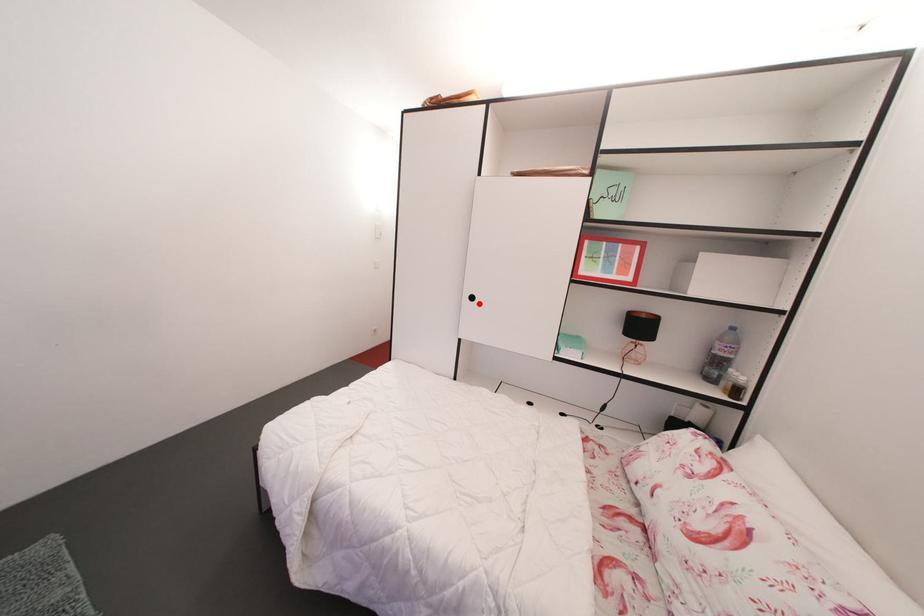
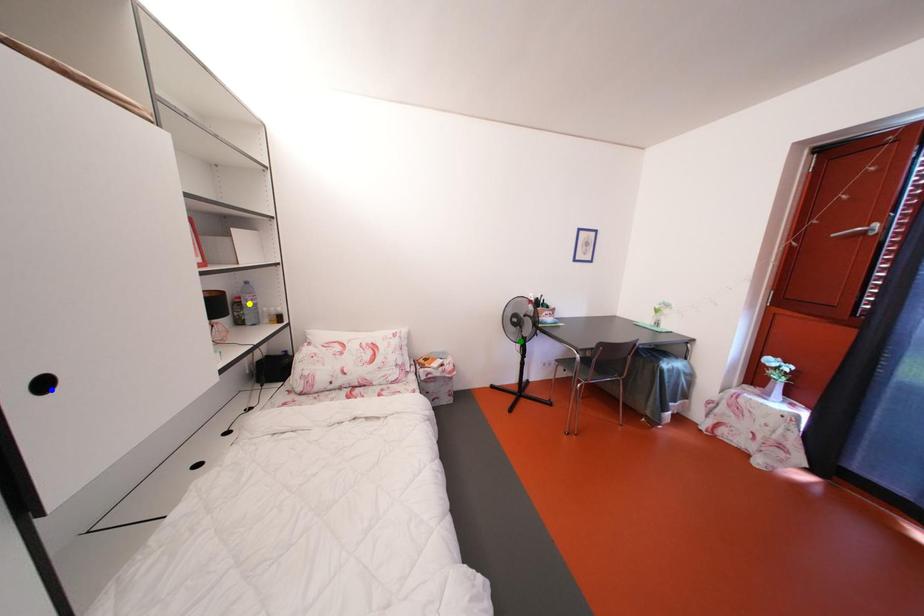
Question: I am providing you with two images of the same scene from different viewpoints. A red point is marked on the first image. You are given multiple points on the second image. Can you choose the point in image 2 that corresponds to the point in image 1?

Choices:
 (A) yellow point
 (B) blue point
 (C) green point

Answer: (B)